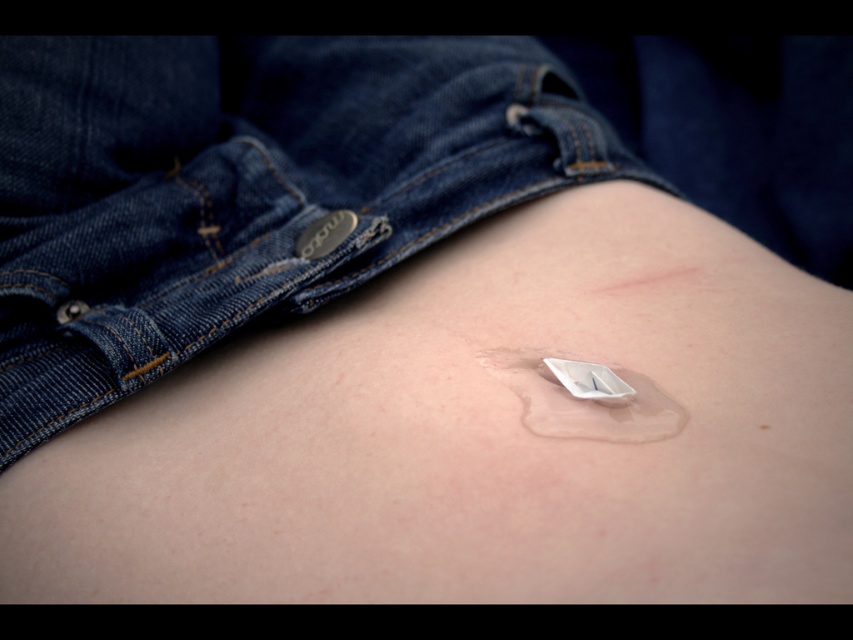
You are a healthcare professional examining a patient wearing dark blue denim shorts. You notice the white matte patch at center and denim at center. Which object is wider?

The denim at center might be wider than the white matte patch at center according to the description.

Based on the scene described, where is the denim at center in relation to the white matte patch at center?

The denim at center is above the white matte patch at center.

You are a healthcare professional examining a patient. You notice the denim at center and the white matte patch at center. Which object is located to the right of the other?

The denim at center is positioned on the left side of white matte patch at center, meaning the white matte patch at center is to the right of the denim at center.